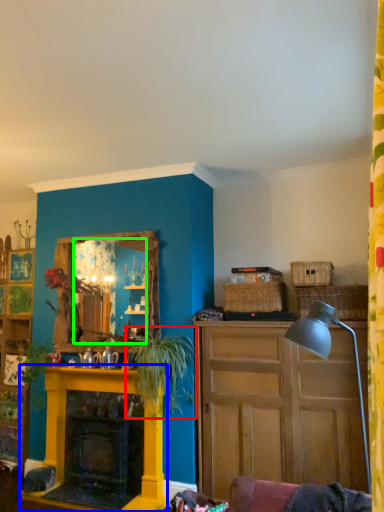
Question: Which object is positioned closest to plant (highlighted by a red box)? Select from fireplace (highlighted by a blue box) and mirror (highlighted by a green box).

Choices:
 (A) fireplace
 (B) mirror

Answer: (B)